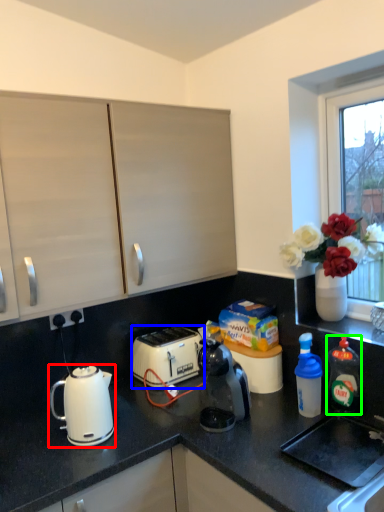
Question: Estimate the real-world distances between objects in this image. Which object is farther from kettle (highlighted by a red box), toaster (highlighted by a blue box) or bottle (highlighted by a green box)?

Choices:
 (A) toaster
 (B) bottle

Answer: (B)